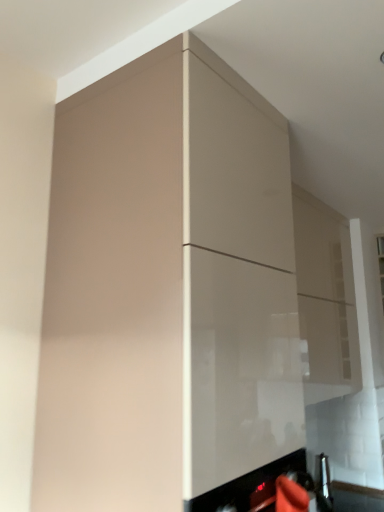
Question: Which direction should I rotate to look at glossy beige cabinet at upper center, which appears as the first cabinetry when viewed from the back, — up or down?

Choices:
 (A) up
 (B) down

Answer: (B)

Question: Does matte beige cabinet at center, the second cabinetry from the back, have a greater width compared to glossy beige cabinet at upper center, which appears as the first cabinetry when viewed from the back?

Choices:
 (A) no
 (B) yes

Answer: (B)

Question: Does matte beige cabinet at center, acting as the 2th cabinetry starting from the right, lie behind glossy beige cabinet at upper center, which is the 2th cabinetry in front-to-back order?

Choices:
 (A) no
 (B) yes

Answer: (A)

Question: From the image's perspective, does matte beige cabinet at center, the second cabinetry from the back, appear lower than glossy beige cabinet at upper center, the first cabinetry in the right-to-left sequence?

Choices:
 (A) yes
 (B) no

Answer: (B)

Question: From a real-world perspective, is matte beige cabinet at center, the first cabinetry from the left, positioned over glossy beige cabinet at upper center, the first cabinetry in the right-to-left sequence, based on gravity?

Choices:
 (A) yes
 (B) no

Answer: (B)

Question: Is matte beige cabinet at center, the first cabinetry from the left, surrounding glossy beige cabinet at upper center, which is the 2th cabinetry in front-to-back order?

Choices:
 (A) no
 (B) yes

Answer: (A)

Question: Can you confirm if matte beige cabinet at center, which ranks as the 1th cabinetry in front-to-back order, is thinner than glossy beige cabinet at upper center, the second cabinetry viewed from the left?

Choices:
 (A) no
 (B) yes

Answer: (A)

Question: Is matte beige cabinet at center, the first cabinetry from the left, at the back of glossy beige cabinet at upper center, which appears as the first cabinetry when viewed from the back?

Choices:
 (A) yes
 (B) no

Answer: (B)

Question: Considering the relative sizes of glossy beige cabinet at upper center, the second cabinetry viewed from the left, and matte beige cabinet at center, the second cabinetry from the back, in the image provided, is glossy beige cabinet at upper center, the second cabinetry viewed from the left, smaller than matte beige cabinet at center, the second cabinetry from the back,?

Choices:
 (A) no
 (B) yes

Answer: (B)

Question: From a real-world perspective, is glossy beige cabinet at upper center, the first cabinetry in the right-to-left sequence, below matte beige cabinet at center, which ranks as the 1th cabinetry in front-to-back order?

Choices:
 (A) yes
 (B) no

Answer: (B)

Question: Is glossy beige cabinet at upper center, which appears as the first cabinetry when viewed from the back, positioned before matte beige cabinet at center, the second cabinetry from the back?

Choices:
 (A) no
 (B) yes

Answer: (A)

Question: Is glossy beige cabinet at upper center, the second cabinetry viewed from the left, bigger than matte beige cabinet at center, the second cabinetry from the back?

Choices:
 (A) no
 (B) yes

Answer: (A)

Question: Can you confirm if glossy beige cabinet at upper center, the second cabinetry viewed from the left, is shorter than matte beige cabinet at center, acting as the 2th cabinetry starting from the right?

Choices:
 (A) yes
 (B) no

Answer: (A)

Question: In the image, is glossy beige cabinet at upper center, the first cabinetry in the right-to-left sequence, on the left side or the right side of matte beige cabinet at center, acting as the 2th cabinetry starting from the right?

Choices:
 (A) right
 (B) left

Answer: (A)